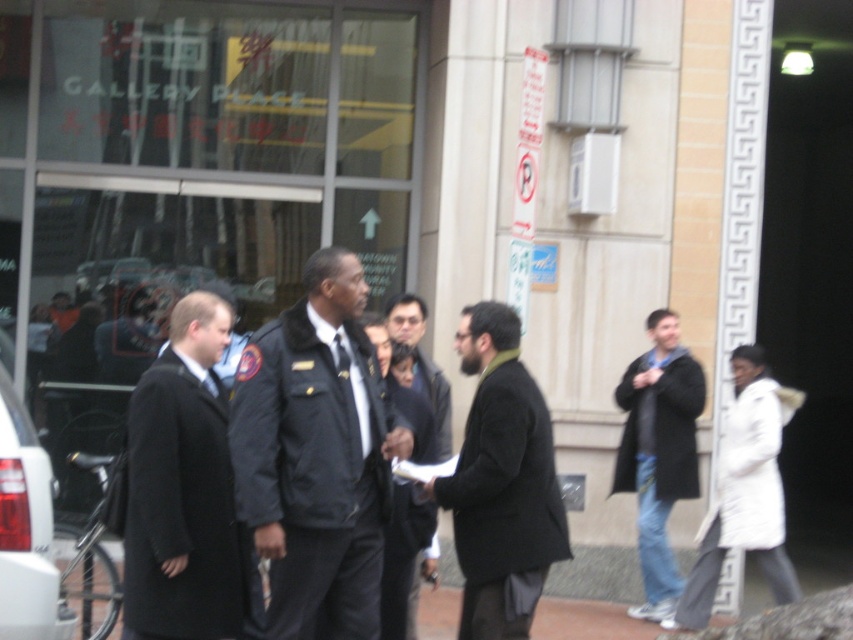
How distant is dark blue uniform at center from dark gray uniform at center?

33.74 inches

Is dark blue uniform at center smaller than dark gray uniform at center?

Actually, dark blue uniform at center might be larger than dark gray uniform at center.

Between point (264, 392) and point (419, 582), which one is positioned behind?

The point (419, 582) is more distant.

You are a GUI agent. You are given a task and a screenshot of the screen. Output one action in this format:
    pyautogui.click(x=<x>, y=<y>)
    Task: Click on the dark blue uniform at center
    This screenshot has height=640, width=853.
    Given the screenshot: What is the action you would take?
    pyautogui.click(x=316, y=456)

Is point (294, 362) farther from viewer compared to point (9, 589)?

Yes, it is behind point (9, 589).

Is dark blue uniform at center behind matte black car at lower left?

Yes, it is.

Who is more forward, [360,632] or [20,572]?

Point [20,572]

At what (x,y) coordinates should I click in order to perform the action: click on dark blue uniform at center. Please return your answer as a coordinate pair (x, y). This screenshot has height=640, width=853. Looking at the image, I should click on (316, 456).

Is point (140, 492) closer to viewer compared to point (51, 611)?

No, (140, 492) is behind (51, 611).

Which is behind, point (175, 332) or point (51, 637)?

The point (175, 332) is more distant.

Is point (223, 337) closer to camera compared to point (45, 588)?

No.

Find the location of a particular element. This screenshot has width=853, height=640. black wool coat at left is located at coordinates (186, 492).